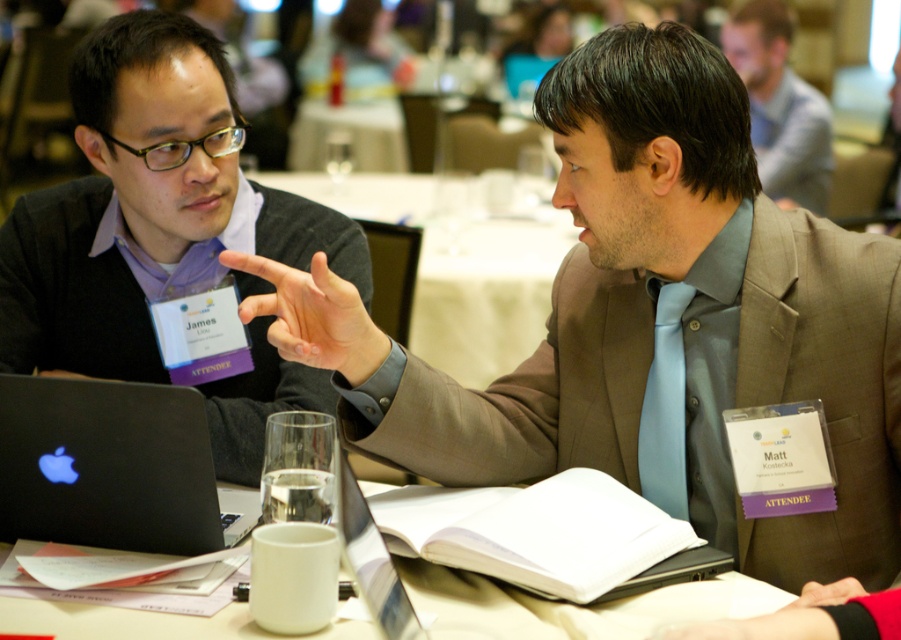
Measure the distance between point (727,282) and camera.

Point (727,282) is 4.41 feet from camera.

Who is more forward, (851, 516) or (645, 420)?

Point (851, 516)

Which is in front, point (592, 186) or point (639, 456)?

Point (592, 186) is more forward.

At what (x,y) coordinates should I click in order to perform the action: click on light brown suit at center. Please return your answer as a coordinate pair (x, y). Image resolution: width=901 pixels, height=640 pixels. Looking at the image, I should click on (651, 320).

Is clear glass table at center wider than white matte table at center?

Correct, the width of clear glass table at center exceeds that of white matte table at center.

Is clear glass table at center to the left of white matte table at center from the viewer's perspective?

Correct, you'll find clear glass table at center to the left of white matte table at center.

What do you see at coordinates (462, 260) in the screenshot? Image resolution: width=901 pixels, height=640 pixels. I see `clear glass table at center` at bounding box center [462, 260].

I want to click on clear glass table at center, so click(462, 260).

In the scene shown: Is white matte table at center further to camera compared to light gray suit at upper right?

No.

Is white matte table at center above light gray suit at upper right?

No, white matte table at center is not above light gray suit at upper right.

Find the location of a particular element. The image size is (901, 640). white matte table at center is located at coordinates (572, 605).

Where is `white matte table at center`? white matte table at center is located at coordinates (572, 605).